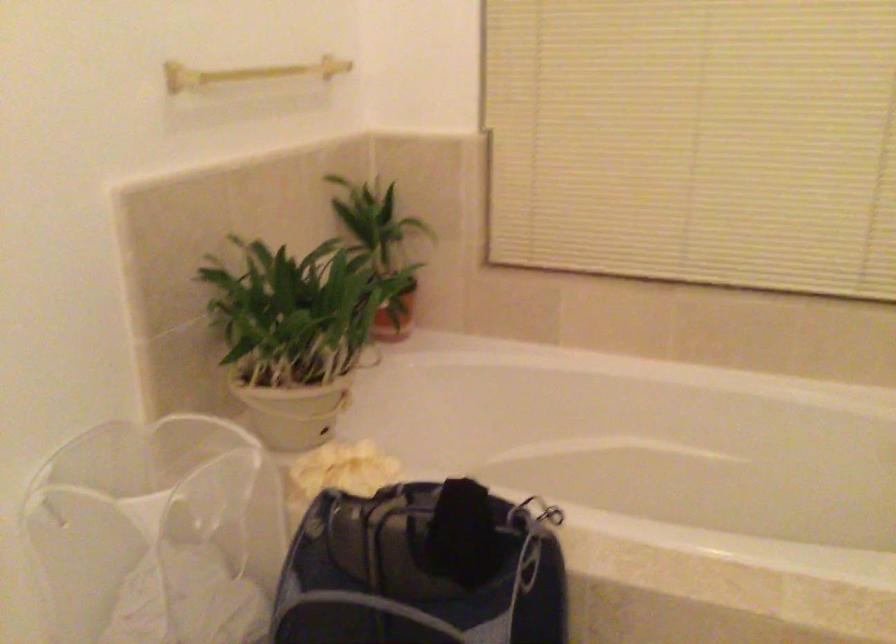
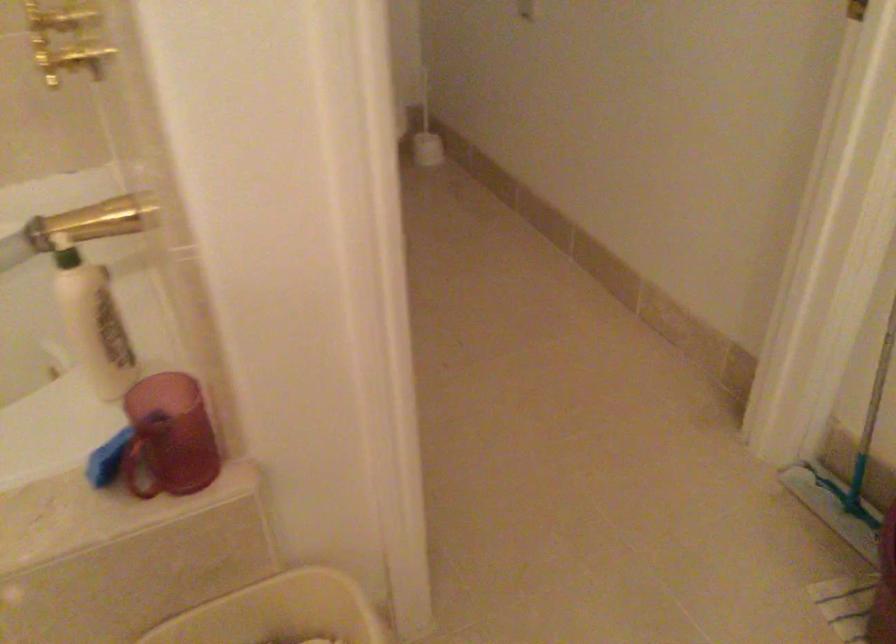
First-person continuous shooting, in which direction is the camera rotating?

The camera rotated toward right-down.